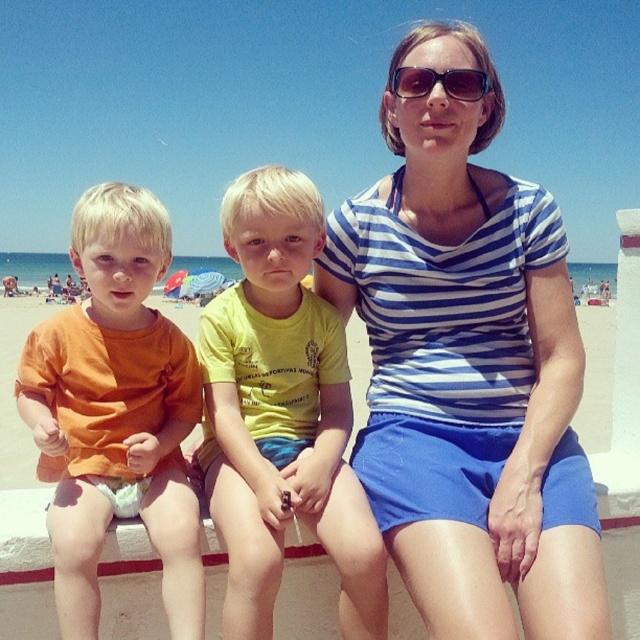
Based on the photo, which of these two, yellow matte shirt at center or sunglasses at center, stands shorter?

sunglasses at center is shorter.

Is point (275, 417) more distant than point (401, 88)?

No, it is in front of (401, 88).

Identify the location of yellow matte shirt at center. click(x=282, y=412).

Which of these two, blue striped shirt at center or orange cotton shirt at left, stands taller?

blue striped shirt at center

In the scene shown: Is blue striped shirt at center thinner than orange cotton shirt at left?

No, blue striped shirt at center is not thinner than orange cotton shirt at left.

Measure the distance between point (x=360, y=200) and camera.

8.99 feet

Where is `blue striped shirt at center`? Image resolution: width=640 pixels, height=640 pixels. blue striped shirt at center is located at coordinates (468, 369).

Which of these two, yellow matte shirt at center or orange cotton shirt at left, stands taller?

yellow matte shirt at center

Is yellow matte shirt at center to the right of orange cotton shirt at left from the viewer's perspective?

Indeed, yellow matte shirt at center is positioned on the right side of orange cotton shirt at left.

Who is more forward, (330, 556) or (28, 358)?

Point (330, 556)

You are a GUI agent. You are given a task and a screenshot of the screen. Output one action in this format:
    pyautogui.click(x=<x>, y=<y>)
    Task: Click on the yellow matte shirt at center
    The width and height of the screenshot is (640, 640).
    Given the screenshot: What is the action you would take?
    pyautogui.click(x=282, y=412)